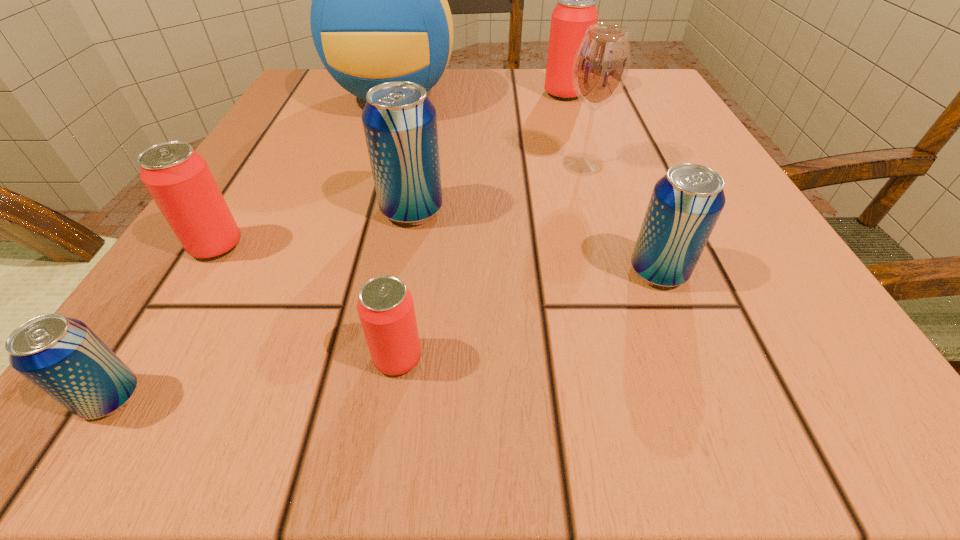
The image size is (960, 540). Identify the location of the second biggest red beer can. (178, 179).

Where is `the second nearest red beer can`? This screenshot has width=960, height=540. the second nearest red beer can is located at coordinates (178, 179).

Find the location of a particular element. This screenshot has width=960, height=540. the second red beer can from left to right is located at coordinates (385, 307).

Where is `the smallest red beer can`? the smallest red beer can is located at coordinates (385, 307).

Find the location of a particular element. The width and height of the screenshot is (960, 540). the leftmost blue beer can is located at coordinates (62, 356).

Image resolution: width=960 pixels, height=540 pixels. Identify the location of the nearest blue beer can. (62, 356).

Image resolution: width=960 pixels, height=540 pixels. Identify the location of free point located on the right of the volleyball. (585, 99).

The width and height of the screenshot is (960, 540). I want to click on free space located on the front of the seventh shortest object, so click(x=601, y=223).

Find the location of a particular element. vacant area situated on the left of the farthest red beer can is located at coordinates (407, 94).

What are the coordinates of `vacant space situated 0.250m on the back of the biggest blue beer can` in the screenshot? It's located at (429, 113).